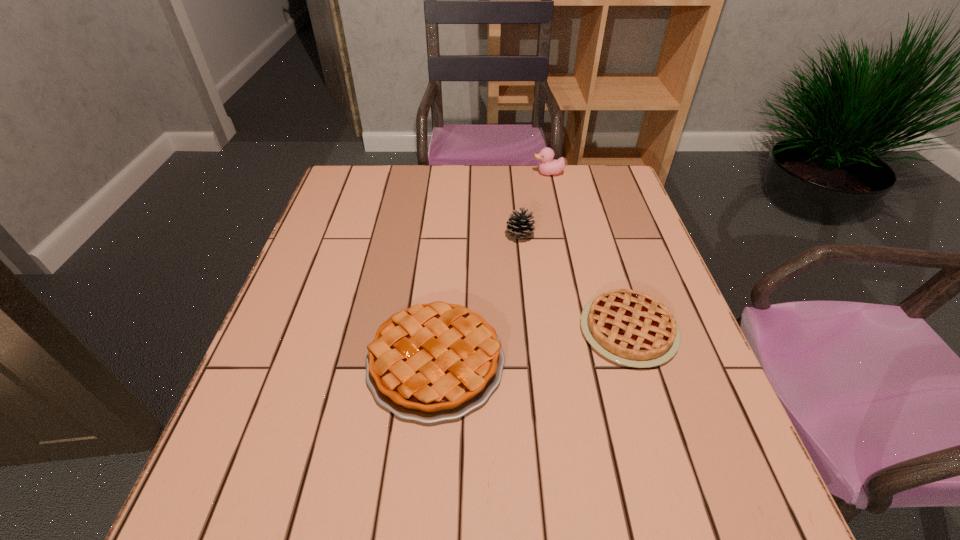
Find the location of `vacant area that lies between the duckling and the shortest object`. vacant area that lies between the duckling and the shortest object is located at coordinates tap(588, 252).

Where is `object that stands as the third closest to the shorter pie`? Image resolution: width=960 pixels, height=540 pixels. object that stands as the third closest to the shorter pie is located at coordinates (547, 166).

Locate an element on the screen. The height and width of the screenshot is (540, 960). object that is the second closest to the duckling is located at coordinates (631, 328).

At what (x,y) coordinates should I click in order to perform the action: click on vacant space that satisfies the following two spatial constraints: 1. on the back side of the second farthest object; 2. on the right side of the taller pie. Please return your answer as a coordinate pair (x, y). This screenshot has width=960, height=540. Looking at the image, I should click on (446, 235).

I want to click on vacant region that satisfies the following two spatial constraints: 1. on the front-facing side of the duckling; 2. on the back side of the right pie, so click(582, 330).

The height and width of the screenshot is (540, 960). Identify the location of free space in the image that satisfies the following two spatial constraints: 1. on the front-facing side of the duckling; 2. on the right side of the shortest object. (582, 330).